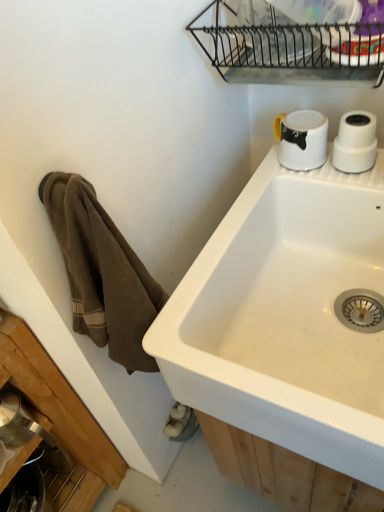
Question: Is point (236, 50) positioned closer to the camera than point (311, 139)?

Choices:
 (A) closer
 (B) farther

Answer: (B)

Question: From a real-world perspective, is metallic wire rack at upper center positioned above or below white glossy mug at upper right?

Choices:
 (A) below
 (B) above

Answer: (B)

Question: Which is nearer to the metallic wire rack at upper center?

Choices:
 (A) white ceramic sink at upper right
 (B) white glossy mug at upper right

Answer: (B)

Question: Estimate the real-world distances between objects in this image. Which object is closer to the metallic wire rack at upper center?

Choices:
 (A) white glossy mug at upper right
 (B) white ceramic sink at upper right

Answer: (A)